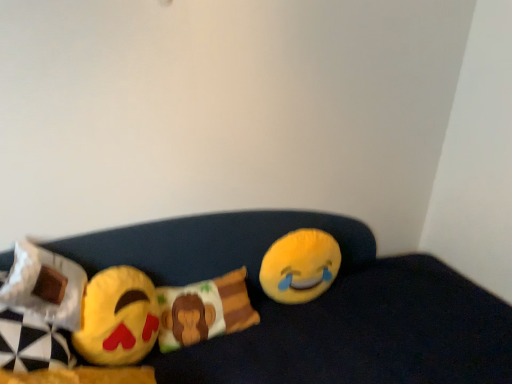
Identify the location of free space above fluffy cotton pillow with monkey design at center, which ranks as the second pillow in left-to-right order (from a real-world perspective). The width and height of the screenshot is (512, 384). (202, 289).